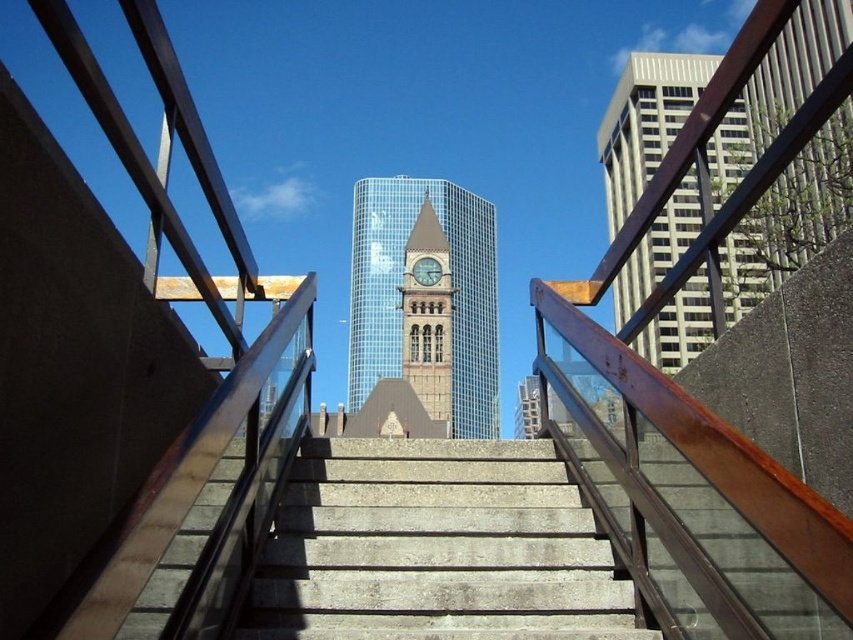
Who is positioned more to the right, concrete stairs at center or smooth gray skyscraper at right?

smooth gray skyscraper at right

Where is `concrete stairs at center`? The height and width of the screenshot is (640, 853). concrete stairs at center is located at coordinates (434, 547).

The height and width of the screenshot is (640, 853). Identify the location of concrete stairs at center. (434, 547).

Does glassy steel clock tower at center have a lesser height compared to brown stone clock tower at center?

No.

Consider the image. Between glassy steel clock tower at center and brown stone clock tower at center, which one has less height?

With less height is brown stone clock tower at center.

I want to click on glassy steel clock tower at center, so click(x=399, y=296).

Where is `glassy steel clock tower at center`? The width and height of the screenshot is (853, 640). glassy steel clock tower at center is located at coordinates (399, 296).

How far apart are smooth gray skyscraper at right and gold textured clock at center?

smooth gray skyscraper at right and gold textured clock at center are 141.37 feet apart.

Does smooth gray skyscraper at right have a greater width compared to gold textured clock at center?

Correct, the width of smooth gray skyscraper at right exceeds that of gold textured clock at center.

Describe the element at coordinates (645, 122) in the screenshot. Image resolution: width=853 pixels, height=640 pixels. I see `smooth gray skyscraper at right` at that location.

At what (x,y) coordinates should I click in order to perform the action: click on smooth gray skyscraper at right. Please return your answer as a coordinate pair (x, y). This screenshot has height=640, width=853. Looking at the image, I should click on (645, 122).